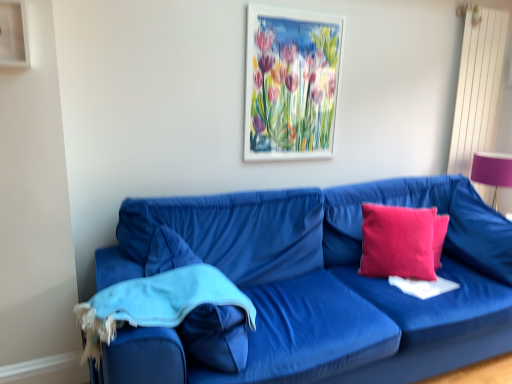
Question: Is the position of velvet blue couch at lower left less distant than that of pink fabric lampshade at right?

Choices:
 (A) no
 (B) yes

Answer: (B)

Question: Considering the relative sizes of velvet blue couch at lower left and pink fabric lampshade at right in the image provided, is velvet blue couch at lower left smaller than pink fabric lampshade at right?

Choices:
 (A) no
 (B) yes

Answer: (A)

Question: Is velvet blue couch at lower left taller than pink fabric lampshade at right?

Choices:
 (A) yes
 (B) no

Answer: (A)

Question: Is velvet blue couch at lower left beside pink fabric lampshade at right?

Choices:
 (A) no
 (B) yes

Answer: (A)

Question: From the image's perspective, is velvet blue couch at lower left on top of pink fabric lampshade at right?

Choices:
 (A) yes
 (B) no

Answer: (B)

Question: From a real-world perspective, is pink fabric pillow at right, which is counted as the second pillow, starting from the left, above or below velvet blue couch at lower left?

Choices:
 (A) above
 (B) below

Answer: (A)

Question: Based on their sizes in the image, would you say pink fabric pillow at right, placed as the 1th pillow when sorted from right to left, is bigger or smaller than velvet blue couch at lower left?

Choices:
 (A) big
 (B) small

Answer: (B)

Question: From their relative heights in the image, would you say pink fabric pillow at right, placed as the 1th pillow when sorted from right to left, is taller or shorter than velvet blue couch at lower left?

Choices:
 (A) short
 (B) tall

Answer: (A)

Question: In terms of width, does pink fabric pillow at right, which is counted as the second pillow, starting from the left, look wider or thinner when compared to velvet blue couch at lower left?

Choices:
 (A) thin
 (B) wide

Answer: (A)

Question: From a real-world perspective, is pink fabric pillow at right, placed as the 1th pillow when sorted from right to left, physically located above or below blue cotton blanket at lower left?

Choices:
 (A) above
 (B) below

Answer: (A)

Question: Is pink fabric pillow at right, which is counted as the second pillow, starting from the left, in front of or behind blue cotton blanket at lower left in the image?

Choices:
 (A) front
 (B) behind

Answer: (B)

Question: Is pink fabric pillow at right, which is counted as the second pillow, starting from the left, inside or outside of blue cotton blanket at lower left?

Choices:
 (A) outside
 (B) inside

Answer: (A)

Question: Visually, is pink fabric pillow at right, which is counted as the second pillow, starting from the left, positioned to the left or to the right of blue cotton blanket at lower left?

Choices:
 (A) left
 (B) right

Answer: (B)

Question: From a real-world perspective, is velvet blue couch at lower left above or below blue cotton blanket at lower left?

Choices:
 (A) above
 (B) below

Answer: (B)

Question: In terms of width, does velvet blue couch at lower left look wider or thinner when compared to blue cotton blanket at lower left?

Choices:
 (A) thin
 (B) wide

Answer: (B)